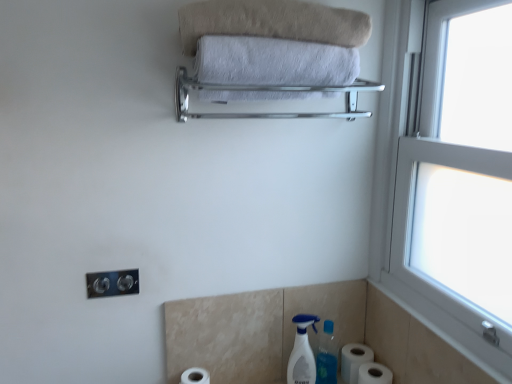
What is the approximate height of white matte toilet paper at lower center, the first toilet paper when ordered from left to right?

It is 4.99 inches.

This screenshot has width=512, height=384. Describe the element at coordinates (272, 22) in the screenshot. I see `beige soft towel at upper center, the 2th towel in the bottom-to-top sequence` at that location.

What is the approximate height of white matte toilet paper at lower right, which is the 2th toilet paper from left to right?

white matte toilet paper at lower right, which is the 2th toilet paper from left to right, is 4.75 inches tall.

Locate an element on the screen. This screenshot has height=384, width=512. white soft towel at upper center, which is the first towel in bottom-to-top order is located at coordinates (273, 62).

Is white matte toilet paper at lower right, acting as the 2th toilet paper starting from the right, not near silver metallic towel rack at upper center?

white matte toilet paper at lower right, acting as the 2th toilet paper starting from the right, is near silver metallic towel rack at upper center, not far away.

Does white matte toilet paper at lower right, acting as the 2th toilet paper starting from the right, have a lesser height compared to silver metallic towel rack at upper center?

Correct, white matte toilet paper at lower right, acting as the 2th toilet paper starting from the right, is not as tall as silver metallic towel rack at upper center.

How different are the orientations of white matte toilet paper at lower right, acting as the 2th toilet paper starting from the right, and silver metallic towel rack at upper center in degrees?

The angle between the facing direction of white matte toilet paper at lower right, acting as the 2th toilet paper starting from the right, and the facing direction of silver metallic towel rack at upper center is 90.8 degrees.

Can you confirm if white matte toilet paper at lower right, acting as the 2th toilet paper starting from the right, is positioned to the right of silver metallic towel rack at upper center?

Yes.

Does point (314, 381) come in front of point (439, 10)?

No, (314, 381) is behind (439, 10).

Which object is closer to the camera, white plastic spray bottle at lower center or white plastic window at right?

white plastic window at right.

From a real-world perspective, relative to white plastic window at right, is white plastic spray bottle at lower center vertically above or below?

white plastic spray bottle at lower center is below white plastic window at right.

Is point (355, 371) more distant than point (194, 381)?

Yes.

In the image, is white matte toilet paper at lower right, acting as the 2th toilet paper starting from the right, positioned in front of or behind white matte toilet paper at lower center, which is counted as the third toilet paper, starting from the right?

white matte toilet paper at lower right, acting as the 2th toilet paper starting from the right, is behind white matte toilet paper at lower center, which is counted as the third toilet paper, starting from the right.

Based on the photo, from a real-world perspective, which is physically above, white matte toilet paper at lower right, which is the 2th toilet paper from left to right, or white matte toilet paper at lower center, which is counted as the third toilet paper, starting from the right?

From a 3D spatial view, white matte toilet paper at lower right, which is the 2th toilet paper from left to right, is above.

Between white plastic spray bottle at lower center and white matte toilet paper at lower right, which is the 2th toilet paper from left to right, which one has less height?

white matte toilet paper at lower right, which is the 2th toilet paper from left to right.

Considering the relative sizes of white plastic spray bottle at lower center and white matte toilet paper at lower right, acting as the 2th toilet paper starting from the right, in the image provided, is white plastic spray bottle at lower center wider than white matte toilet paper at lower right, acting as the 2th toilet paper starting from the right,?

No, white plastic spray bottle at lower center is not wider than white matte toilet paper at lower right, acting as the 2th toilet paper starting from the right.

You are a GUI agent. You are given a task and a screenshot of the screen. Output one action in this format:
    pyautogui.click(x=<x>, y=<y>)
    Task: Click on the 1st toilet paper to the right when counting from the white plastic spray bottle at lower center
    This screenshot has width=512, height=384.
    Given the screenshot: What is the action you would take?
    pyautogui.click(x=354, y=360)

Which object is further away from the camera, white plastic spray bottle at lower center or white matte toilet paper at lower right, acting as the 2th toilet paper starting from the right?

white matte toilet paper at lower right, acting as the 2th toilet paper starting from the right, is further away from the camera.

From the image's perspective, which one is positioned lower, white plastic window at right or silver metallic towel rack at upper center?

white plastic window at right, from the image's perspective.

I want to click on balustrade above the white plastic window at right (from a real-world perspective), so click(x=269, y=91).

What's the angular difference between white plastic window at right and silver metallic towel rack at upper center's facing directions?

The angle between the facing direction of white plastic window at right and the facing direction of silver metallic towel rack at upper center is 88.9 degrees.

Based on the photo, in terms of width, does white plastic window at right look wider or thinner when compared to silver metallic towel rack at upper center?

Clearly, white plastic window at right has less width compared to silver metallic towel rack at upper center.

Would you say white matte toilet paper at lower right, acting as the 2th toilet paper starting from the right, contains white soft towel at upper center, which is the first towel in bottom-to-top order?

No, white soft towel at upper center, which is the first towel in bottom-to-top order, is not a part of white matte toilet paper at lower right, acting as the 2th toilet paper starting from the right.

Who is smaller, white matte toilet paper at lower right, acting as the 2th toilet paper starting from the right, or white soft towel at upper center, which is the first towel in bottom-to-top order?

Smaller between the two is white matte toilet paper at lower right, acting as the 2th toilet paper starting from the right.

How different are the orientations of white matte toilet paper at lower right, which is the 2th toilet paper from left to right, and white soft towel at upper center, the second towel from the top, in degrees?

The angle between the facing direction of white matte toilet paper at lower right, which is the 2th toilet paper from left to right, and the facing direction of white soft towel at upper center, the second towel from the top, is 90.8 degrees.

This screenshot has width=512, height=384. I want to click on the 1st toilet paper below the white soft towel at upper center, which is the first towel in bottom-to-top order (from the image's perspective), so click(x=354, y=360).

Does point (378, 367) appear closer or farther from the camera than point (367, 355)?

Point (378, 367).

Is white matte toilet paper at lower right, the third toilet paper viewed from the left, oriented away from white matte toilet paper at lower right, which is the 2th toilet paper from left to right?

white matte toilet paper at lower right, the third toilet paper viewed from the left, does not have its back to white matte toilet paper at lower right, which is the 2th toilet paper from left to right.

In the scene shown: Considering the relative positions of white matte toilet paper at lower right, the third toilet paper viewed from the left, and white matte toilet paper at lower right, which is the 2th toilet paper from left to right, in the image provided, is white matte toilet paper at lower right, the third toilet paper viewed from the left, to the left of white matte toilet paper at lower right, which is the 2th toilet paper from left to right, from the viewer's perspective?

No, white matte toilet paper at lower right, the third toilet paper viewed from the left, is not to the left of white matte toilet paper at lower right, which is the 2th toilet paper from left to right.

Where is `the 1st toilet paper counting from the right of the silver metallic towel rack at upper center`? The image size is (512, 384). the 1st toilet paper counting from the right of the silver metallic towel rack at upper center is located at coordinates (354, 360).

In the image, there is a white plastic window at right. Identify the location of cleaning product below it (from a real-world perspective). (302, 352).

Looking at the image, which one is located closer to white matte toilet paper at lower right, which is the 2th toilet paper from left to right, white matte toilet paper at lower right, the third toilet paper viewed from the left, or beige soft towel at upper center, which is the 1th towel from top to bottom?

white matte toilet paper at lower right, the third toilet paper viewed from the left, is closer to white matte toilet paper at lower right, which is the 2th toilet paper from left to right.

Estimate the real-world distances between objects in this image. Which object is closer to white plastic window at right, beige soft towel at upper center, which is the 1th towel from top to bottom, or white matte toilet paper at lower center, the first toilet paper when ordered from left to right?

beige soft towel at upper center, which is the 1th towel from top to bottom, is positioned closer to the anchor white plastic window at right.

Estimate the real-world distances between objects in this image. Which object is further from white matte toilet paper at lower right, the third toilet paper viewed from the left, silver metallic towel rack at upper center or white plastic window at right?

silver metallic towel rack at upper center lies further to white matte toilet paper at lower right, the third toilet paper viewed from the left, than the other object.

Estimate the real-world distances between objects in this image. Which object is further from white plastic spray bottle at lower center, white soft towel at upper center, which is the first towel in bottom-to-top order, or white matte toilet paper at lower center, the first toilet paper when ordered from left to right?

white soft towel at upper center, which is the first towel in bottom-to-top order.

In the scene shown: Based on their spatial positions, is white matte toilet paper at lower center, which is counted as the third toilet paper, starting from the right, or satin nickel outlet at lower left further from white matte toilet paper at lower right, which is the 1th toilet paper in right-to-left order?

satin nickel outlet at lower left lies further to white matte toilet paper at lower right, which is the 1th toilet paper in right-to-left order, than the other object.

Which object lies further to the anchor point white soft towel at upper center, which is the first towel in bottom-to-top order, satin nickel outlet at lower left or white matte toilet paper at lower center, which is counted as the third toilet paper, starting from the right?

Among the two, white matte toilet paper at lower center, which is counted as the third toilet paper, starting from the right, is located further to white soft towel at upper center, which is the first towel in bottom-to-top order.

Considering their positions, is silver metallic towel rack at upper center positioned further to white plastic spray bottle at lower center than white soft towel at upper center, the second towel from the top?

Based on the image, white soft towel at upper center, the second towel from the top, appears to be further to white plastic spray bottle at lower center.

Looking at the image, which one is located further to white plastic spray bottle at lower center, white plastic window at right or white matte toilet paper at lower center, which is counted as the third toilet paper, starting from the right?

white plastic window at right is positioned further to the anchor white plastic spray bottle at lower center.

Locate an element on the screen. This screenshot has height=384, width=512. towel that lies between beige soft towel at upper center, the 2th towel in the bottom-to-top sequence, and satin nickel outlet at lower left from top to bottom is located at coordinates (273, 62).

Locate an element on the screen. window between silver metallic towel rack at upper center and white plastic spray bottle at lower center from top to bottom is located at coordinates click(411, 225).

Where is `balustrade between beige soft towel at upper center, which is the 1th towel from top to bottom, and white matte toilet paper at lower center, which is counted as the third toilet paper, starting from the right, in the vertical direction`? balustrade between beige soft towel at upper center, which is the 1th towel from top to bottom, and white matte toilet paper at lower center, which is counted as the third toilet paper, starting from the right, in the vertical direction is located at coordinates (269, 91).

You are a GUI agent. You are given a task and a screenshot of the screen. Output one action in this format:
    pyautogui.click(x=<x>, y=<y>)
    Task: Click on the window between beige soft towel at upper center, the 2th towel in the bottom-to-top sequence, and white matte toilet paper at lower right, which is the 1th toilet paper in right-to-left order, from top to bottom
    This screenshot has height=384, width=512.
    Given the screenshot: What is the action you would take?
    pyautogui.click(x=411, y=225)